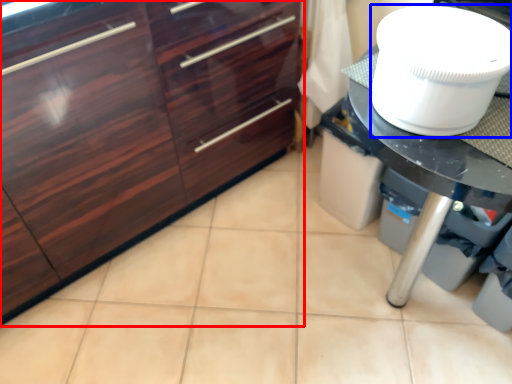
Question: Which object appears farthest to the camera in this image, cabinetry (highlighted by a red box) or toilet bowl (highlighted by a blue box)?

Choices:
 (A) cabinetry
 (B) toilet bowl

Answer: (A)